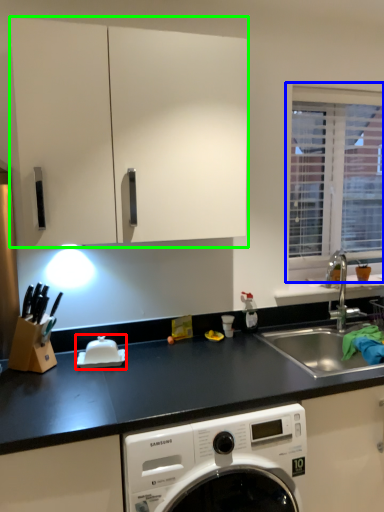
Question: Based on their relative distances, which object is nearer to appliance (highlighted by a red box)? Choose from window (highlighted by a blue box) and cabinetry (highlighted by a green box).

Choices:
 (A) window
 (B) cabinetry

Answer: (B)